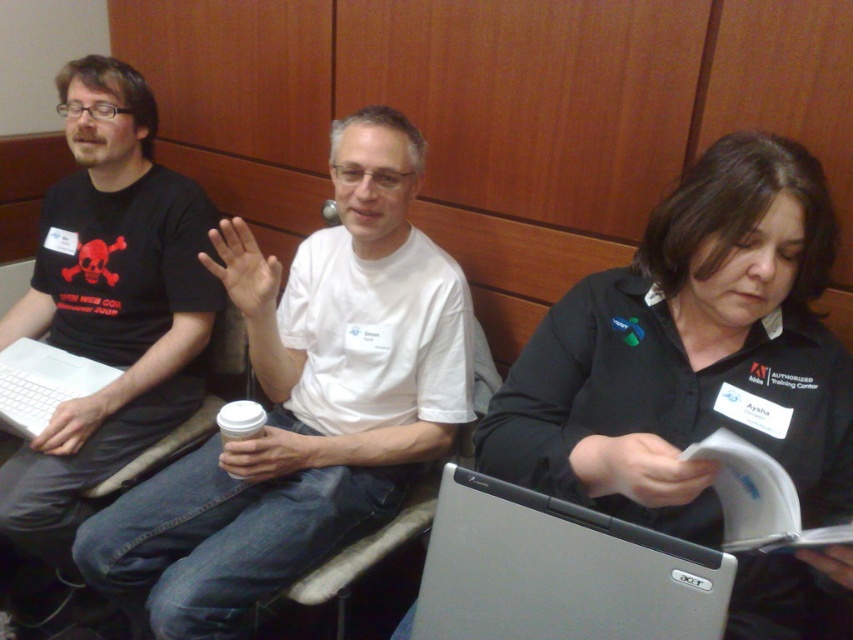
Question: Does white matte t-shirt at center come behind matte black t-shirt at left?

Choices:
 (A) yes
 (B) no

Answer: (B)

Question: Among these objects, which one is farthest from the camera?

Choices:
 (A) silver metallic laptop at center
 (B) matte black t-shirt at left

Answer: (B)

Question: Is black fabric shirt at center above faux leather chair at center?

Choices:
 (A) yes
 (B) no

Answer: (A)

Question: Which point is farther to the camera?

Choices:
 (A) (540, 577)
 (B) (453, 310)
 (C) (115, 108)

Answer: (C)

Question: Which object is positioned closest to the silver metallic laptop at center?

Choices:
 (A) white matte t-shirt at center
 (B) black fabric shirt at center
 (C) matte black t-shirt at left

Answer: (B)

Question: Observing the image, what is the correct spatial positioning of faux leather chair at center in reference to white matte laptop at left?

Choices:
 (A) below
 (B) above

Answer: (A)